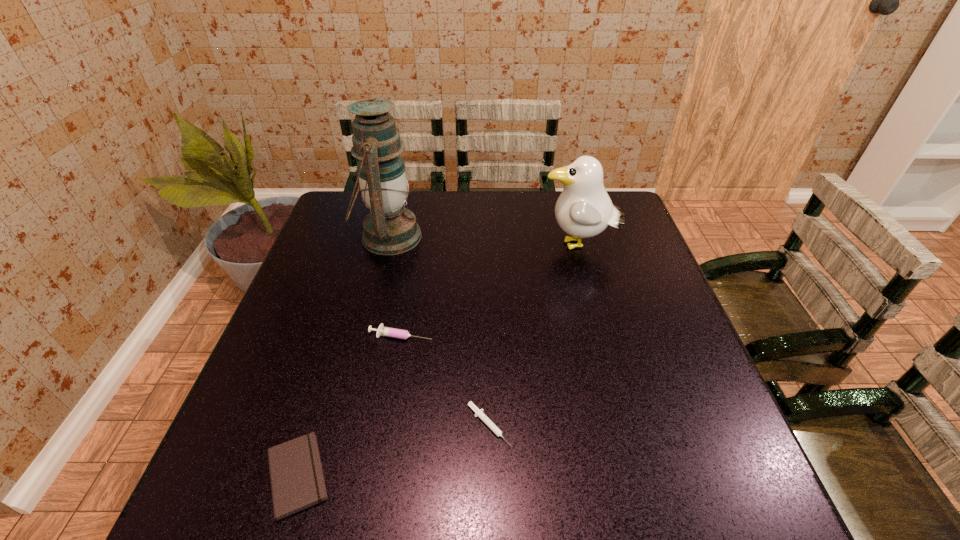
The width and height of the screenshot is (960, 540). Identify the location of oil lamp. (389, 229).

The width and height of the screenshot is (960, 540). Find the location of `the rightmost object`. the rightmost object is located at coordinates (584, 209).

Where is `the fourth shortest object`? This screenshot has height=540, width=960. the fourth shortest object is located at coordinates (584, 209).

Locate an element on the screen. Image resolution: width=960 pixels, height=540 pixels. the left syringe is located at coordinates (383, 331).

The height and width of the screenshot is (540, 960). In order to click on the farther syringe in this screenshot , I will do point(383,331).

Where is `the shorter syringe`? The width and height of the screenshot is (960, 540). the shorter syringe is located at coordinates 479,413.

At what (x,y) coordinates should I click in order to perform the action: click on the fourth object from left to right. Please return your answer as a coordinate pair (x, y). The image size is (960, 540). Looking at the image, I should click on (479, 413).

Locate an element on the screen. checkbook is located at coordinates (297, 482).

Identify the location of vacant space located 0.070m on the right of the tallest object. (444, 237).

The height and width of the screenshot is (540, 960). I want to click on blank space located on the beak of the second tallest object, so (444, 246).